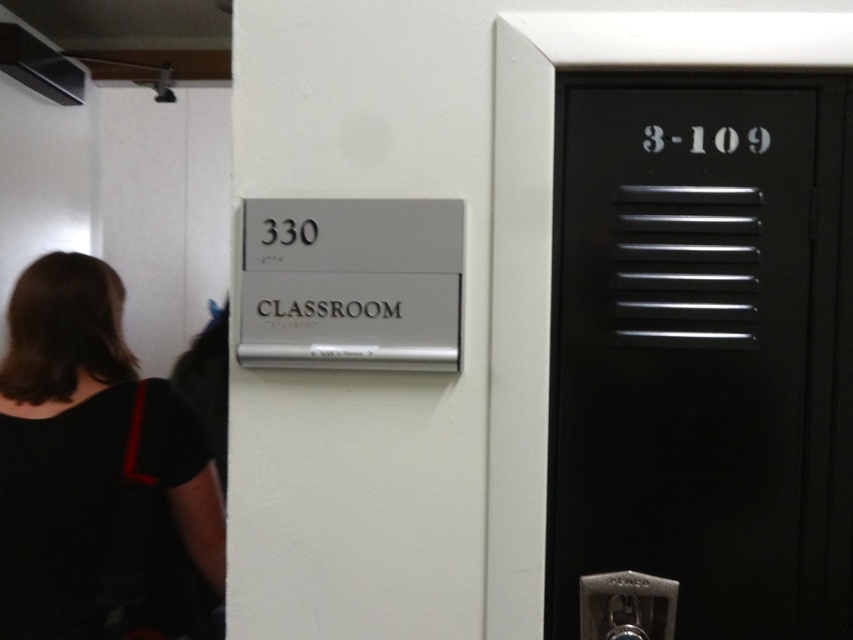
Can you confirm if black fabric at left is taller than black metal elevator at right?

In fact, black fabric at left may be shorter than black metal elevator at right.

Does black fabric at left have a smaller size compared to black metal elevator at right?

No, black fabric at left is not smaller than black metal elevator at right.

Locate an element on the screen. The height and width of the screenshot is (640, 853). black fabric at left is located at coordinates (96, 470).